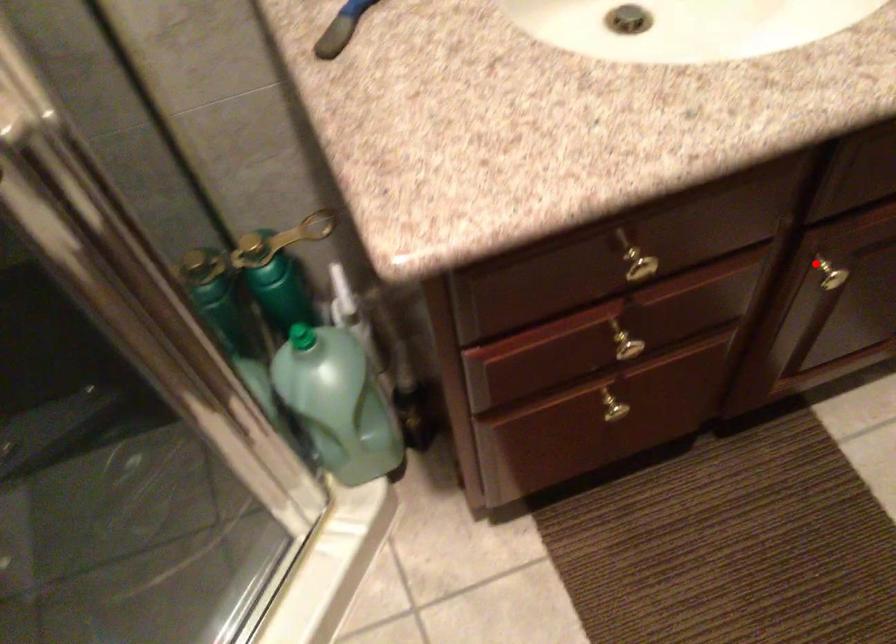
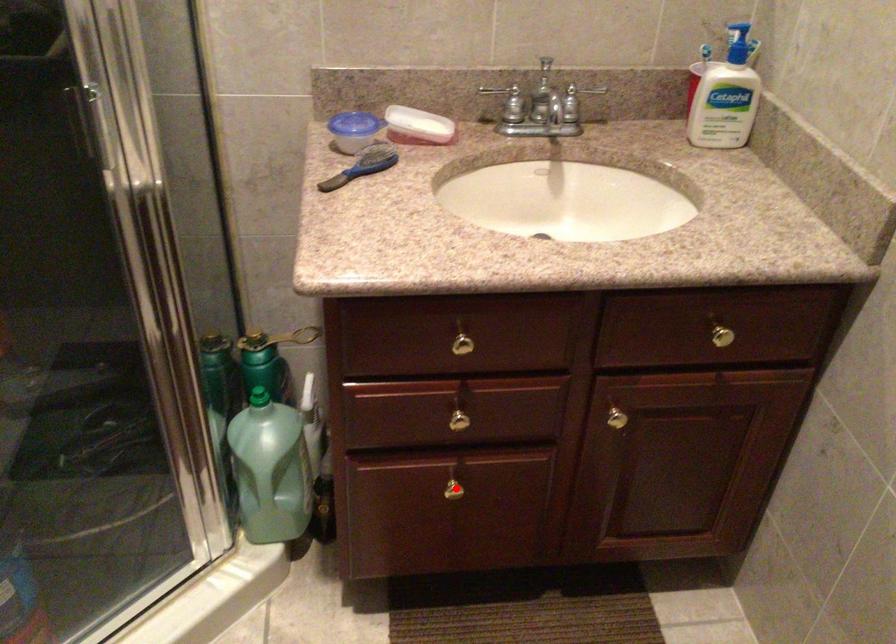
I am providing you with two images of the same scene from different viewpoints. A red point is marked on the first image and another point is marked on the second image. Is the marked point in image1 the same physical position as the marked point in image2?

No